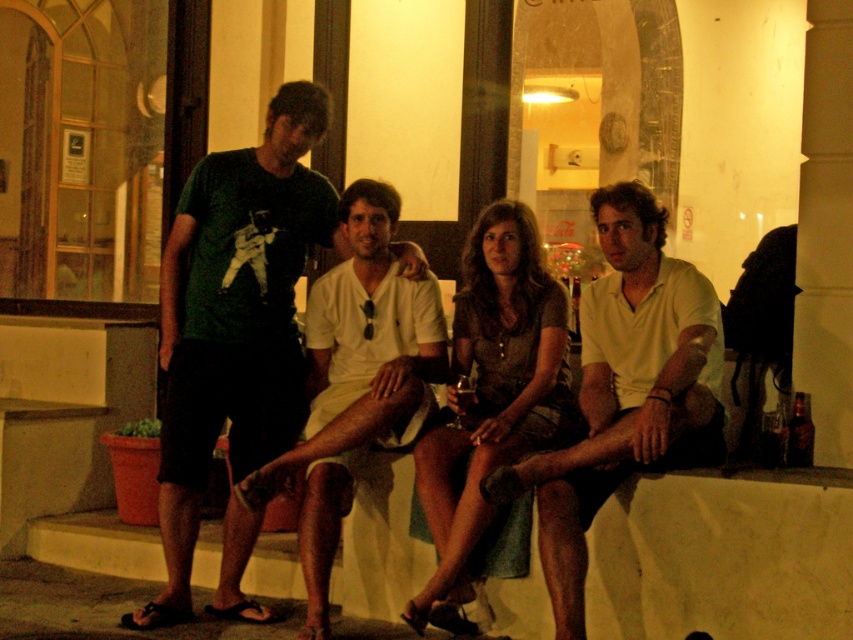
Question: Which of these objects is positioned farthest from the matte brown dress at center?

Choices:
 (A) green matte t-shirt at center
 (B) white cotton shorts at center

Answer: (A)

Question: Based on their relative distances, which object is farther from the white cotton shirt at center?

Choices:
 (A) white cotton shorts at center
 (B) green matte t-shirt at center
 (C) matte brown dress at center

Answer: (B)

Question: Does green matte t-shirt at center appear on the left side of white cotton shorts at center?

Choices:
 (A) yes
 (B) no

Answer: (A)

Question: Can you confirm if white cotton shirt at center is thinner than white cotton shorts at center?

Choices:
 (A) no
 (B) yes

Answer: (A)

Question: Which object is the farthest from the green matte t-shirt at center?

Choices:
 (A) matte brown dress at center
 (B) white cotton shorts at center

Answer: (A)

Question: Is white cotton shirt at center wider than white cotton shorts at center?

Choices:
 (A) no
 (B) yes

Answer: (B)